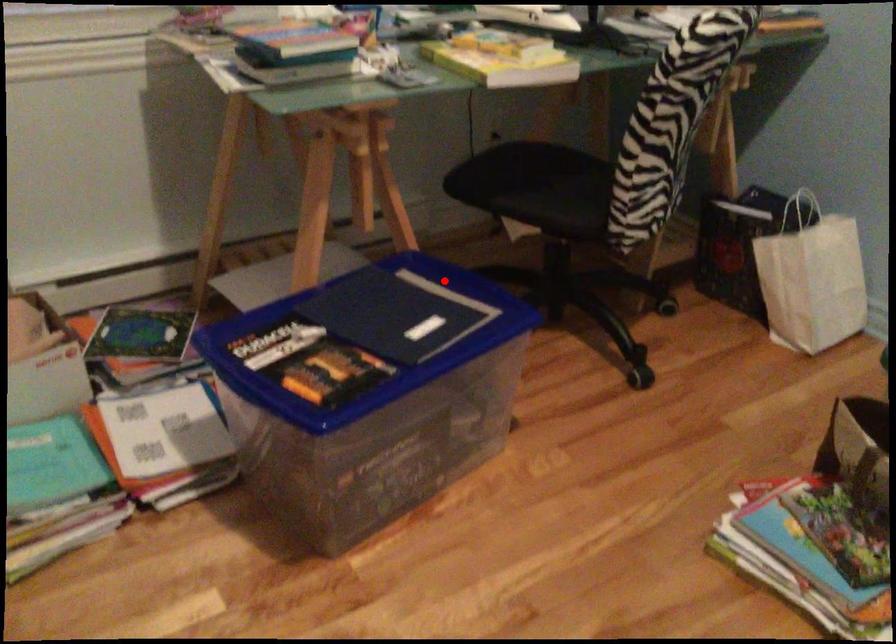
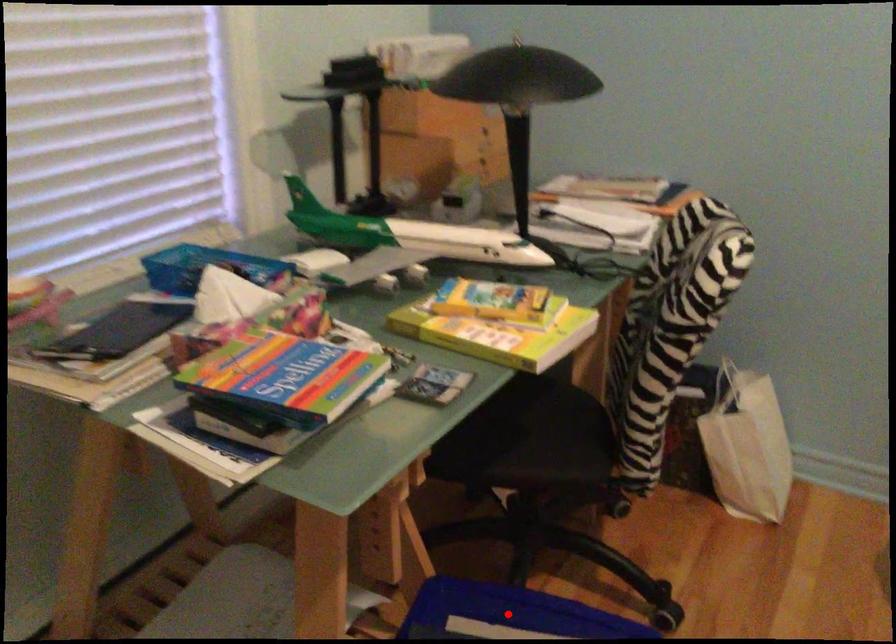
I am providing you with two images of the same scene from different viewpoints. A red point is marked on the first image and another point is marked on the second image. Are the points marked in image1 and image2 representing the same 3D position?

Yes